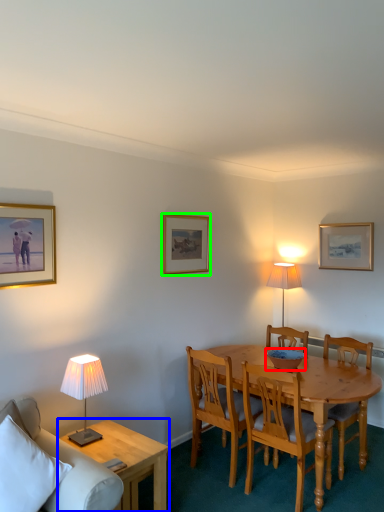
Question: Which object is positioned closest to bowl (highlighted by a red box)? Select from coffee table (highlighted by a blue box) and picture frame (highlighted by a green box).

Choices:
 (A) coffee table
 (B) picture frame

Answer: (B)